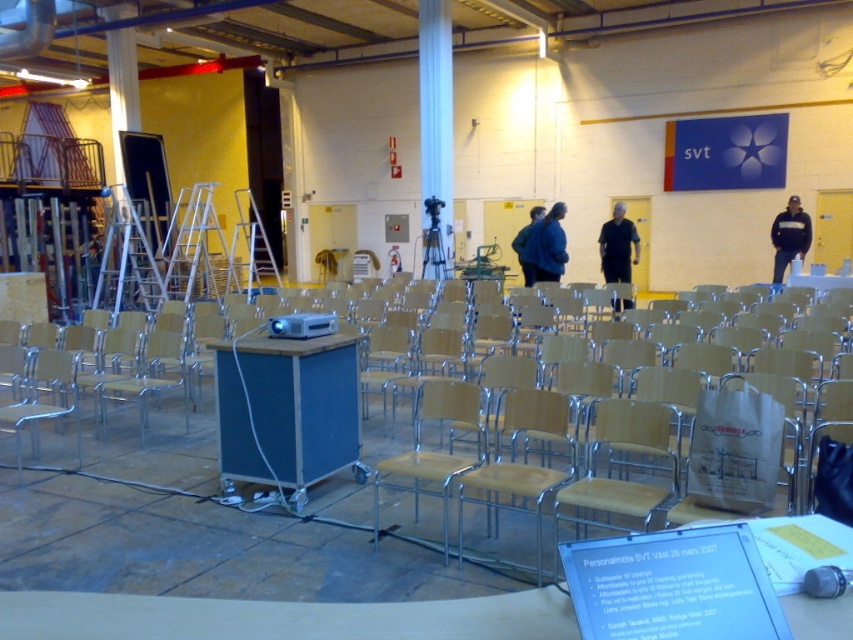
Question: Which point is closer to the camera?

Choices:
 (A) (x=532, y=248)
 (B) (x=514, y=404)

Answer: (B)

Question: Where is blue wood table at center located in relation to black matte shirt at center in the image?

Choices:
 (A) above
 (B) below

Answer: (B)

Question: From the image, what is the correct spatial relationship of black matte shirt at center in relation to blue fabric jacket at center?

Choices:
 (A) below
 (B) above

Answer: (B)

Question: Among these objects, which one is farthest from the camera?

Choices:
 (A) blue wood table at center
 (B) black fleece jacket at upper right
 (C) wooden seat at center
 (D) wooden table at center

Answer: (B)

Question: Can you confirm if wooden at center is positioned above black matte shirt at center?

Choices:
 (A) yes
 (B) no

Answer: (B)

Question: Which object is farther from the camera taking this photo?

Choices:
 (A) black matte shirt at center
 (B) metallic yellow chair at center
 (C) wooden at center
 (D) matte blue shirt at center

Answer: (A)